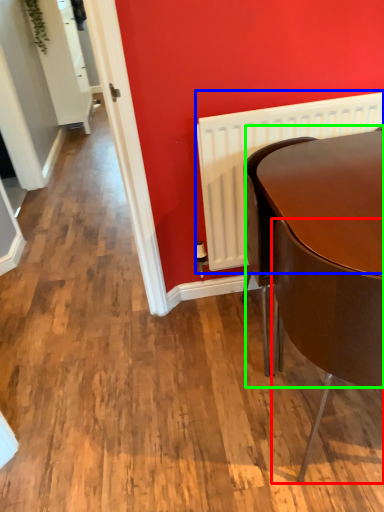
Question: Which object is the farthest from chair (highlighted by a red box)? Choose among these: radiator (highlighted by a blue box) or round table (highlighted by a green box).

Choices:
 (A) radiator
 (B) round table

Answer: (A)